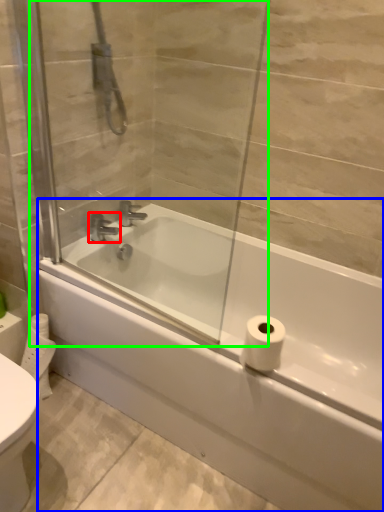
Question: Based on their relative distances, which object is farther from tap (highlighted by a red box)? Choose from bathtub (highlighted by a blue box) and screen door (highlighted by a green box).

Choices:
 (A) bathtub
 (B) screen door

Answer: (A)